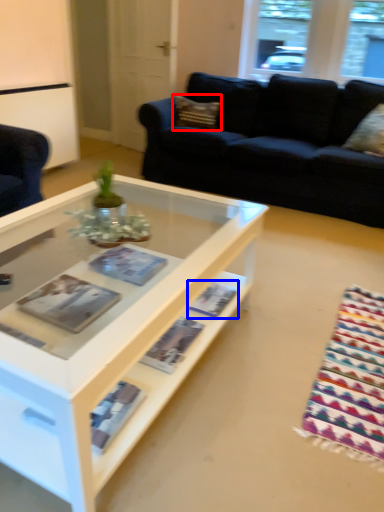
Question: Which of the following is the closest to the observer, pillow (highlighted by a red box) or magazine (highlighted by a blue box)?

Choices:
 (A) pillow
 (B) magazine

Answer: (B)